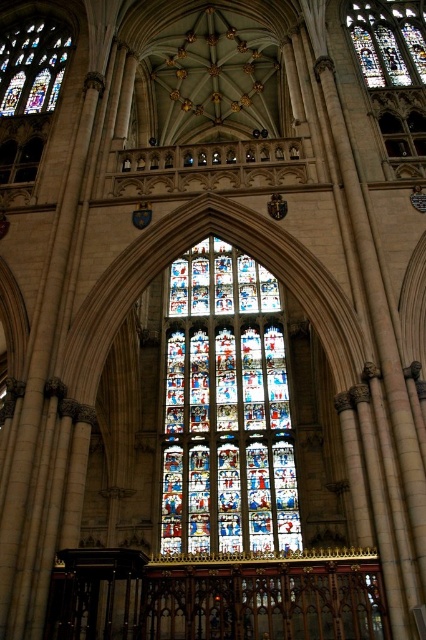
Question: Among these points, which one is nearest to the camera?

Choices:
 (A) (389, 74)
 (B) (388, 64)

Answer: (A)

Question: Does multicolored stained glass window at center have a lesser width compared to stained glass window at upper left?

Choices:
 (A) no
 (B) yes

Answer: (B)

Question: Can you confirm if stained glass window at upper center is positioned below stained glass window at upper left?

Choices:
 (A) no
 (B) yes

Answer: (B)

Question: Which of the following is the farthest from the observer?

Choices:
 (A) (57, 74)
 (B) (411, 52)
 (C) (368, 45)

Answer: (C)

Question: Is stained glass window at upper center above stained glass window at upper left?

Choices:
 (A) yes
 (B) no

Answer: (B)

Question: Which point is farther to the camera?

Choices:
 (A) stained glass window at upper center
 (B) stained glass window at center

Answer: (B)